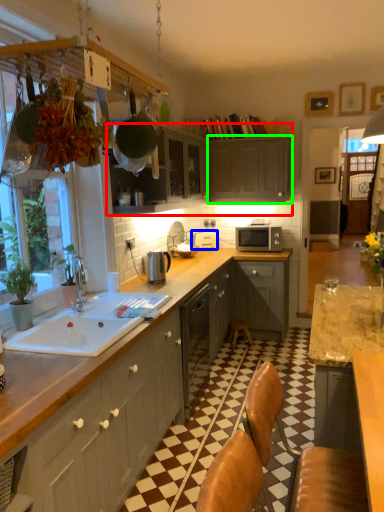
Question: Which is farther away from cabinetry (highlighted by a red box)? appliance (highlighted by a blue box) or cabinetry (highlighted by a green box)?

Choices:
 (A) appliance
 (B) cabinetry

Answer: (A)